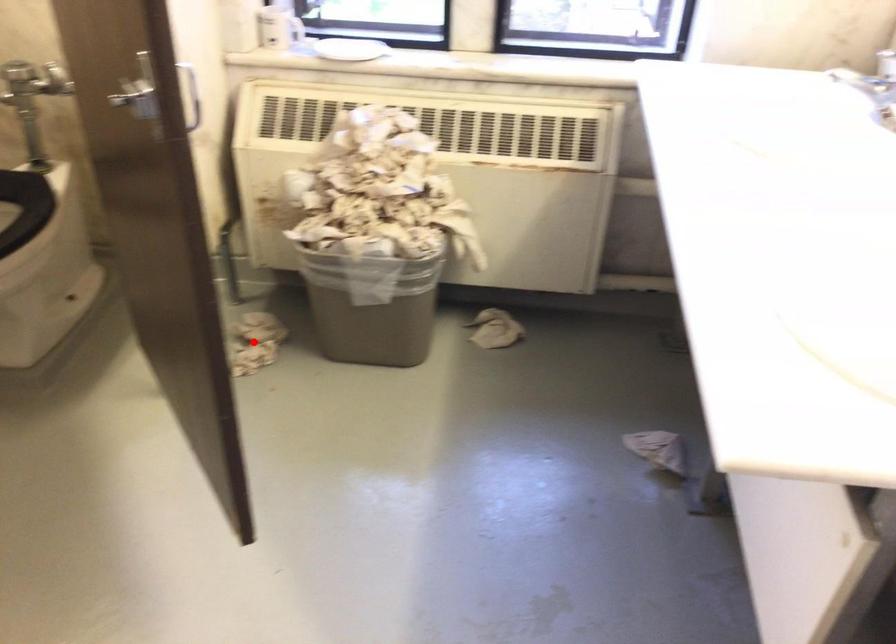
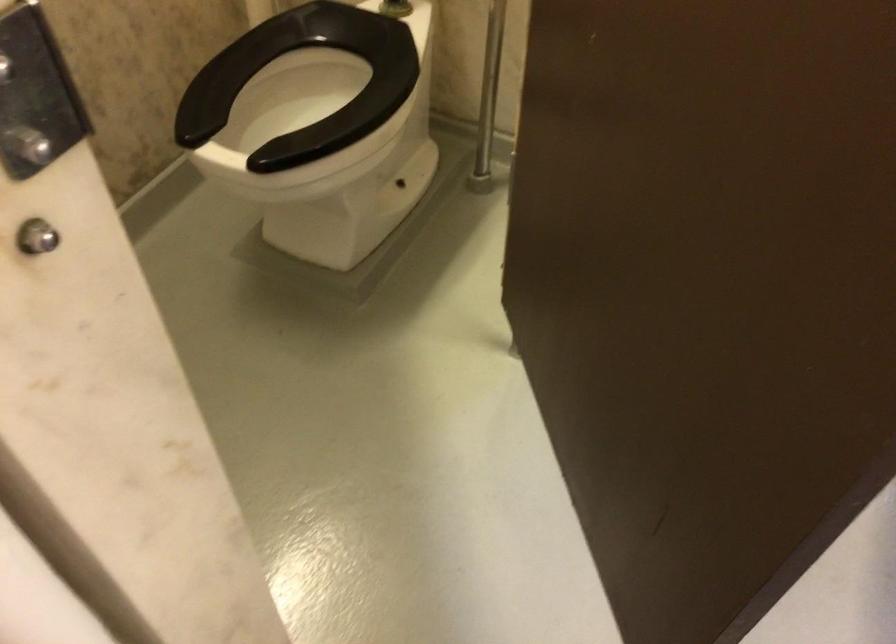
Question: I am providing you with two images of the same scene from different viewpoints. A red point is marked on the first image. At the location where the point appears in image 1, is it still visible in image 2?

Choices:
 (A) Yes
 (B) No

Answer: (B)